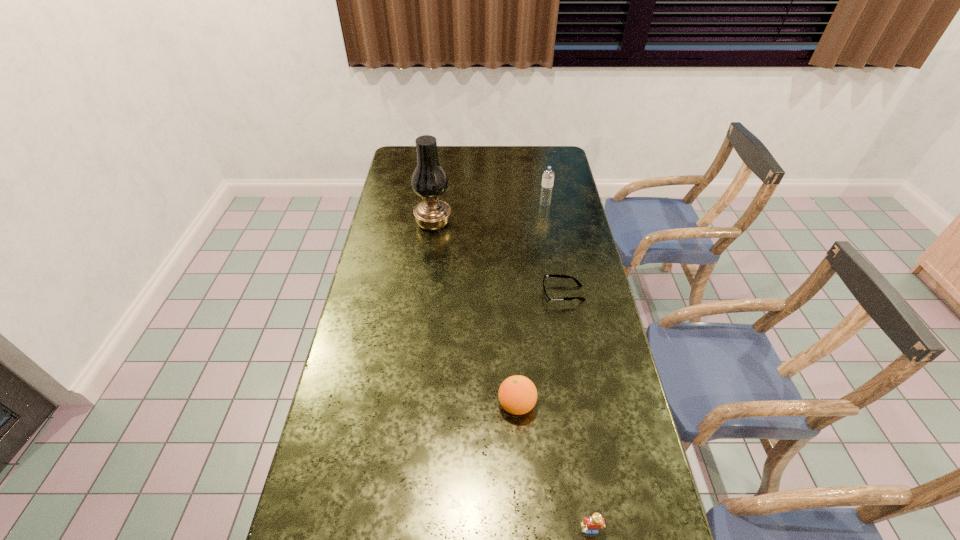
This screenshot has height=540, width=960. I want to click on blank space located on the right of the oil lamp, so click(465, 223).

Where is `vacant space located 0.050m on the left of the farthest object`? The width and height of the screenshot is (960, 540). vacant space located 0.050m on the left of the farthest object is located at coordinates (527, 204).

This screenshot has width=960, height=540. I want to click on vacant space positioned on the back of the fourth farthest object, so click(511, 308).

Locate an element on the screen. The width and height of the screenshot is (960, 540). vacant area located on the front-facing side of the third nearest object is located at coordinates (465, 293).

Locate an element on the screen. Image resolution: width=960 pixels, height=540 pixels. free region located on the front-facing side of the third nearest object is located at coordinates (476, 293).

At what (x,y) coordinates should I click in order to perform the action: click on vacant space situated 0.390m on the front-facing side of the third nearest object. Please return your answer as a coordinate pair (x, y). The image size is (960, 540). Looking at the image, I should click on (425, 293).

You are a GUI agent. You are given a task and a screenshot of the screen. Output one action in this format:
    pyautogui.click(x=<x>, y=<y>)
    Task: Click on the object present at the left edge
    This screenshot has height=540, width=960.
    Given the screenshot: What is the action you would take?
    pyautogui.click(x=429, y=181)

Identify the location of water bottle that is at the right edge. The image size is (960, 540). (548, 175).

You are a GUI agent. You are given a task and a screenshot of the screen. Output one action in this format:
    pyautogui.click(x=<x>, y=<y>)
    Task: Click on the Lego that is at the right edge
    Image resolution: width=960 pixels, height=540 pixels.
    Given the screenshot: What is the action you would take?
    pyautogui.click(x=595, y=522)

This screenshot has width=960, height=540. I want to click on sunglasses located at the right edge, so click(549, 275).